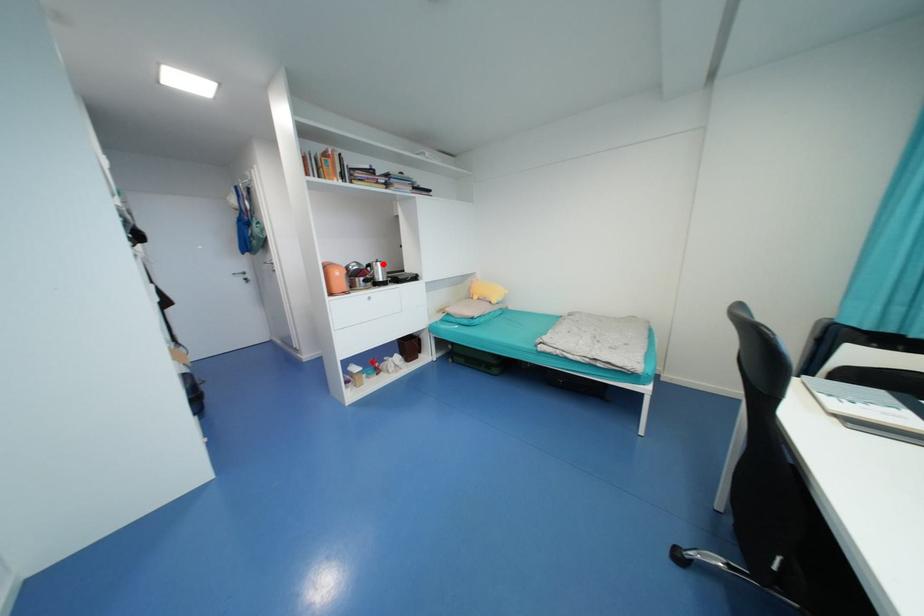
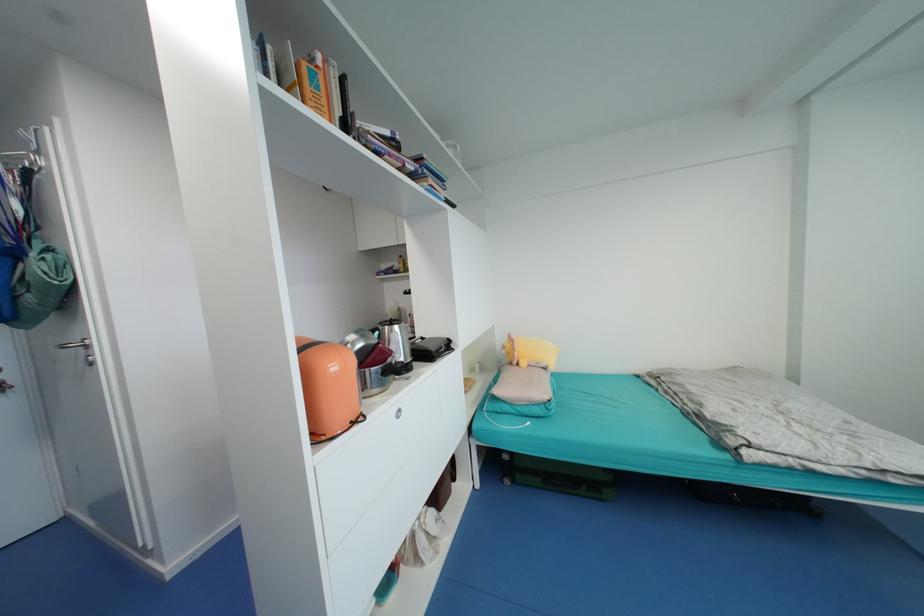
Locate, in the second image, the point that corresponds to the highlighted location in the first image.

(400, 328)